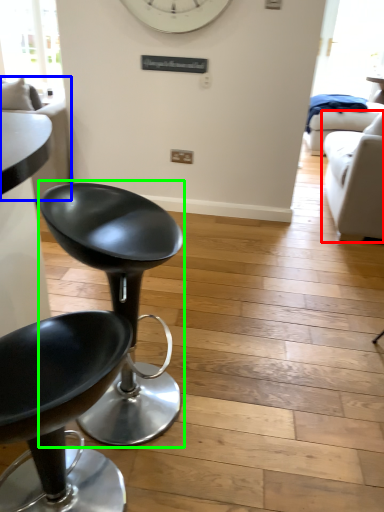
Question: Estimate the real-world distances between objects in this image. Which object is closer to studio couch (highlighted by a red box), couch (highlighted by a blue box) or chair (highlighted by a green box)?

Choices:
 (A) couch
 (B) chair

Answer: (B)